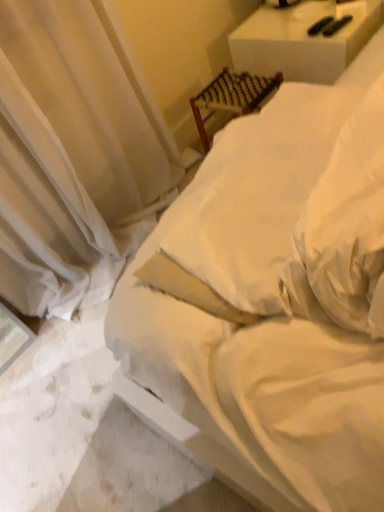
Question: Which is correct: white sheer curtain at upper left is inside woven wood chair at upper center, which ranks as the first furniture in left-to-right order, or outside of it?

Choices:
 (A) inside
 (B) outside

Answer: (B)

Question: From their relative heights in the image, would you say white sheer curtain at upper left is taller or shorter than woven wood chair at upper center, marked as the second furniture in a right-to-left arrangement?

Choices:
 (A) tall
 (B) short

Answer: (A)

Question: Based on their relative distances, which object is nearer to the white woven chair at upper right, the 2th furniture from the left?

Choices:
 (A) white sheer curtain at upper left
 (B) white soft bed at center
 (C) woven wood chair at upper center, marked as the second furniture in a right-to-left arrangement

Answer: (C)

Question: Based on their relative distances, which object is farther from the white woven chair at upper right, the first furniture when ordered from right to left?

Choices:
 (A) white sheer curtain at upper left
 (B) white soft bed at center
 (C) woven wood chair at upper center, marked as the second furniture in a right-to-left arrangement

Answer: (B)